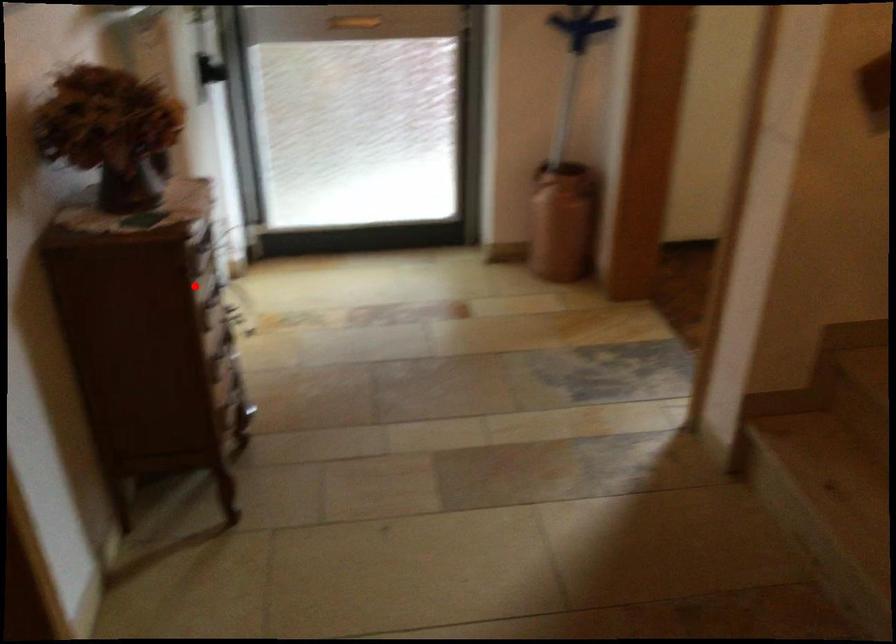
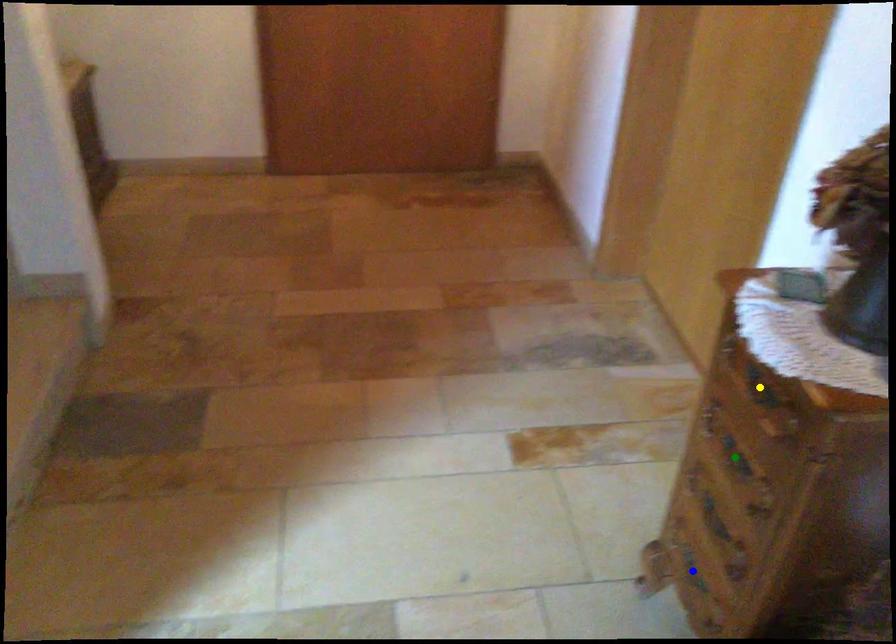
Question: I am providing you with two images of the same scene from different viewpoints. A red point is marked on the first image. You are given multiple points on the second image. Which mark in image 2 goes with the point in image 1?

Choices:
 (A) yellow point
 (B) green point
 (C) blue point

Answer: (A)